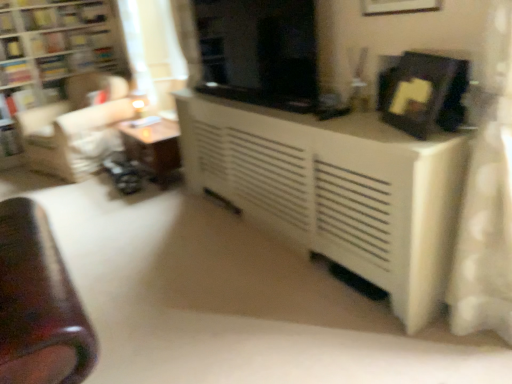
You are a GUI agent. You are given a task and a screenshot of the screen. Output one action in this format:
    pyautogui.click(x=<x>, y=<y>)
    Task: Click on the free location in front of wooden table at left, marked as the first table in a back-to-front arrangement
    The image size is (512, 384).
    Given the screenshot: What is the action you would take?
    pyautogui.click(x=145, y=204)